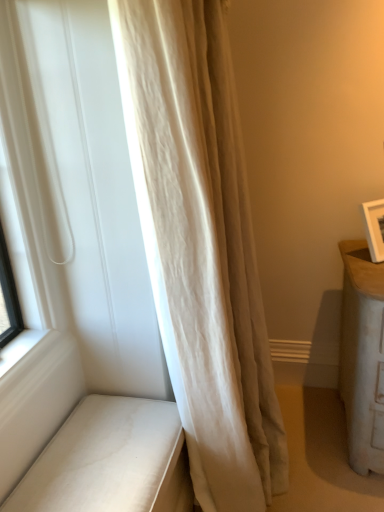
Find the location of a particular element. This screenshot has height=512, width=384. white leather bench at lower left is located at coordinates (110, 461).

This screenshot has width=384, height=512. What do you see at coordinates (110, 461) in the screenshot?
I see `white leather bench at lower left` at bounding box center [110, 461].

The image size is (384, 512). Find the location of `beige silk curtain at left`. beige silk curtain at left is located at coordinates (201, 245).

Looking at this image, in order to face beige silk curtain at left, should I rotate leftwards or rightwards?

Rotate right and turn 5.182 degrees.

Describe the element at coordinates (201, 245) in the screenshot. I see `beige silk curtain at left` at that location.

The width and height of the screenshot is (384, 512). I want to click on white leather bench at lower left, so click(x=110, y=461).

Can you confirm if beige silk curtain at left is positioned to the right of white leather bench at lower left?

Correct, you'll find beige silk curtain at left to the right of white leather bench at lower left.

Is the position of beige silk curtain at left more distant than that of white leather bench at lower left?

No, the depth of beige silk curtain at left is less than that of white leather bench at lower left.

Is point (233, 429) closer to camera compared to point (59, 451)?

No, it is not.

From the image's perspective, between beige silk curtain at left and white leather bench at lower left, who is located below?

white leather bench at lower left, from the image's perspective.

From a real-world perspective, is beige silk curtain at left over white leather bench at lower left?

Yes, from a real-world perspective, beige silk curtain at left is above white leather bench at lower left.

Does beige silk curtain at left have a lesser width compared to white leather bench at lower left?

No.

Does beige silk curtain at left have a greater height compared to white leather bench at lower left?

Correct, beige silk curtain at left is much taller as white leather bench at lower left.

Between beige silk curtain at left and white leather bench at lower left, which one has larger size?

With larger size is beige silk curtain at left.

Is beige silk curtain at left not within white leather bench at lower left?

Yes.

Are beige silk curtain at left and white leather bench at lower left far apart?

No, beige silk curtain at left is in close proximity to white leather bench at lower left.

Is beige silk curtain at left facing away from white leather bench at lower left?

beige silk curtain at left does not have its back to white leather bench at lower left.

How different are the orientations of beige silk curtain at left and white leather bench at lower left in degrees?

90.4 degrees separate the facing orientations of beige silk curtain at left and white leather bench at lower left.

You are a GUI agent. You are given a task and a screenshot of the screen. Output one action in this format:
    pyautogui.click(x=<x>, y=<y>)
    Task: Click on the furniture on the left of the beige silk curtain at left
    
    Given the screenshot: What is the action you would take?
    pyautogui.click(x=110, y=461)

In the scene shown: Based on their positions, is white leather bench at lower left located to the left or right of beige silk curtain at left?

white leather bench at lower left is to the left of beige silk curtain at left.

Is white leather bench at lower left in front of or behind beige silk curtain at left in the image?

Visually, white leather bench at lower left is located behind beige silk curtain at left.

Does point (120, 475) appear closer or farther from the camera than point (256, 481)?

Point (120, 475) is closer to the camera than point (256, 481).

From the image's perspective, between white leather bench at lower left and beige silk curtain at left, which one is located above?

beige silk curtain at left.

From a real-world perspective, is white leather bench at lower left located higher than beige silk curtain at left?

No, from a real-world perspective, white leather bench at lower left is not over beige silk curtain at left

Which of these two, white leather bench at lower left or beige silk curtain at left, is wider?

beige silk curtain at left is wider.

Who is shorter, white leather bench at lower left or beige silk curtain at left?

white leather bench at lower left is shorter.

Between white leather bench at lower left and beige silk curtain at left, which one has smaller size?

white leather bench at lower left is smaller.

Is white leather bench at lower left situated inside beige silk curtain at left or outside?

white leather bench at lower left is not inside beige silk curtain at left, it's outside.

Is white leather bench at lower left not close to beige silk curtain at left?

white leather bench at lower left is actually quite close to beige silk curtain at left.

Does white leather bench at lower left turn towards beige silk curtain at left?

Yes, white leather bench at lower left is facing beige silk curtain at left.

Locate an element on the screen. The width and height of the screenshot is (384, 512). curtain on the right of white leather bench at lower left is located at coordinates (201, 245).

Where is `furniture lying behind the beige silk curtain at left`? The image size is (384, 512). furniture lying behind the beige silk curtain at left is located at coordinates (110, 461).

At what (x,y) coordinates should I click in order to perform the action: click on curtain on the right side of white leather bench at lower left. Please return your answer as a coordinate pair (x, y). Image resolution: width=384 pixels, height=512 pixels. Looking at the image, I should click on (201, 245).